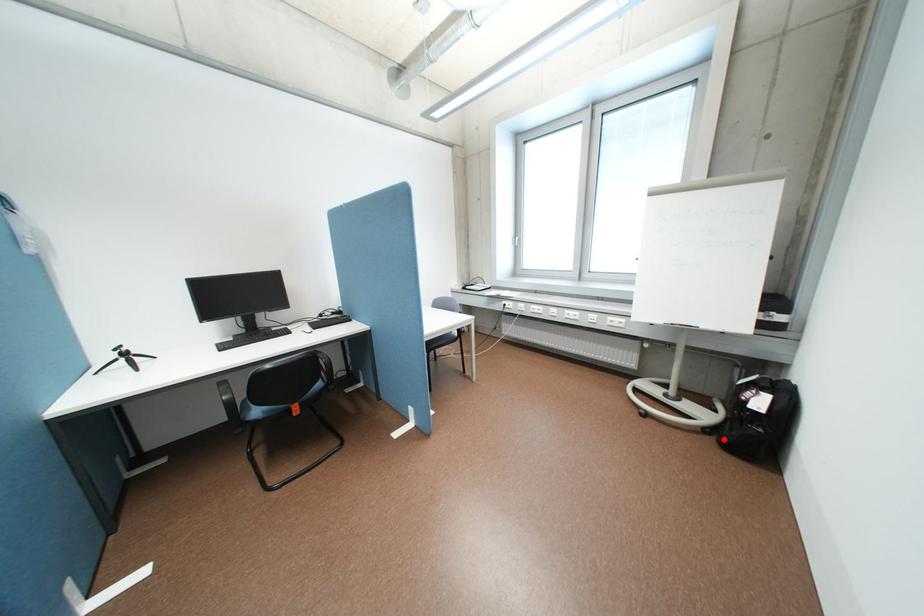
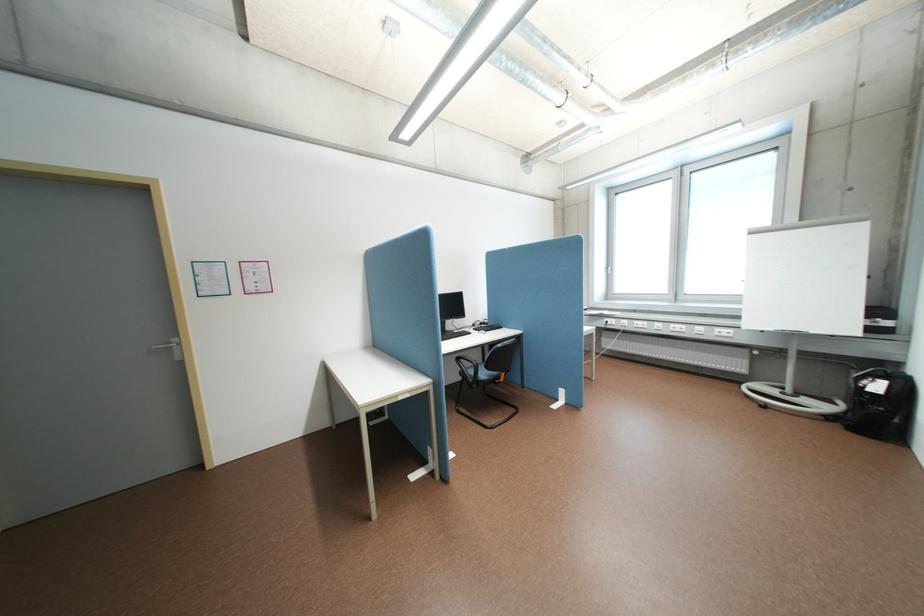
Locate, in the second image, the point that corresponds to the highlighted location in the first image.

(848, 424)